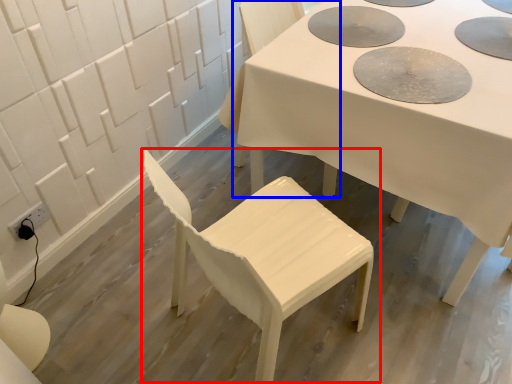
Question: Which object is further to the camera taking this photo, chair (highlighted by a red box) or chair (highlighted by a blue box)?

Choices:
 (A) chair
 (B) chair

Answer: (B)